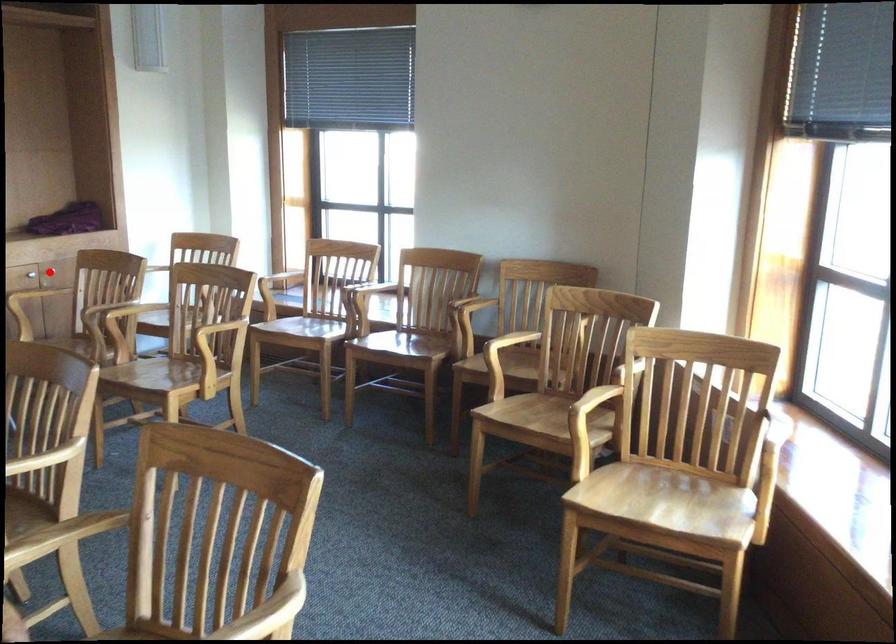
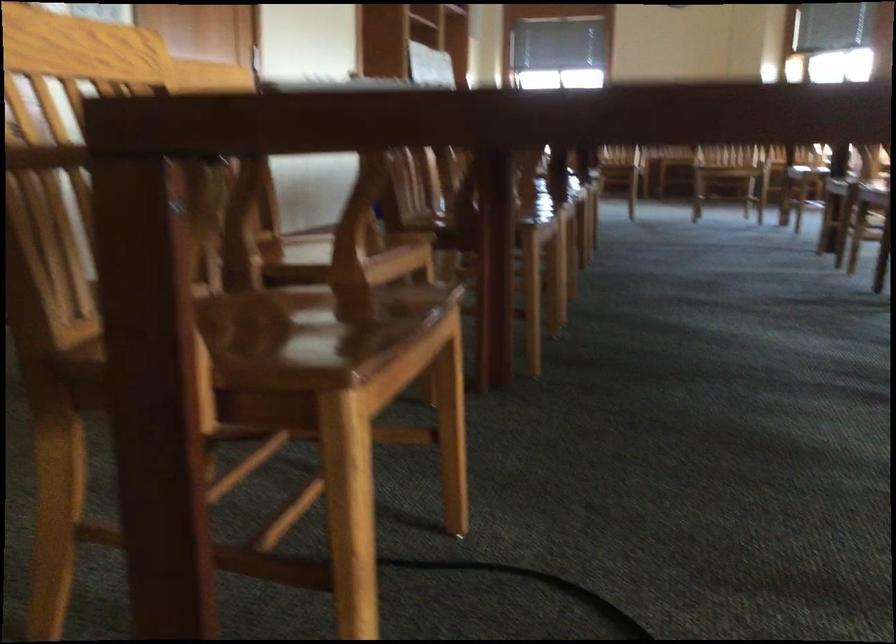
Question: I am providing you with two images of the same scene from different viewpoints. A red point is marked on the first image. Is the red point's position out of view in image 2?

Choices:
 (A) Yes
 (B) No

Answer: (A)